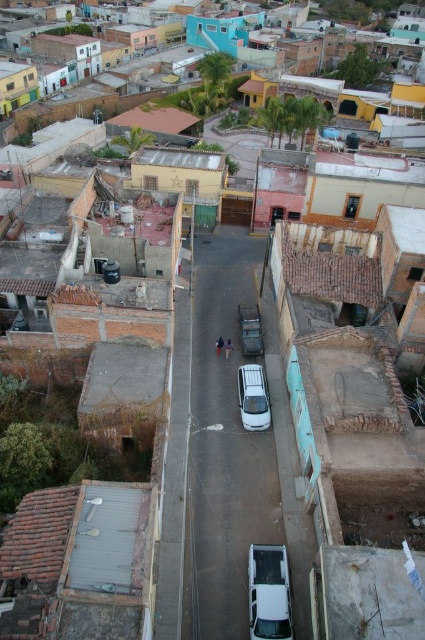
You are a delivery person trying to park a new white car in this area. The parking spot available is exactly the length of the white glossy car at center. Can your new car, which is the same length as the white matte car at center, fit into this parking spot?

The white glossy car at center is shorter than the white matte car at center. Since the parking spot is the same length as the shorter car, the new car, which is as long as the longer white matte car at center, will not fit into the parking spot.

You are a delivery drone flying over the urban area shown in the scene. You need to land on the white glossy car at center. According to the coordinates provided, where exactly should you aim to land?

The white glossy car at center is located at point (269, 593), so you should aim for those coordinates to land safely on it.

You are standing at the viewpoint of the image and want to reach the point marked at coordinates point (260, 589). If you walk straight ahead, will you arrive at that point within 25 meters?

The distance between point (260, 589) and the viewer is 22.27 meters, so yes, you will arrive at the point within 25 meters by walking straight ahead.